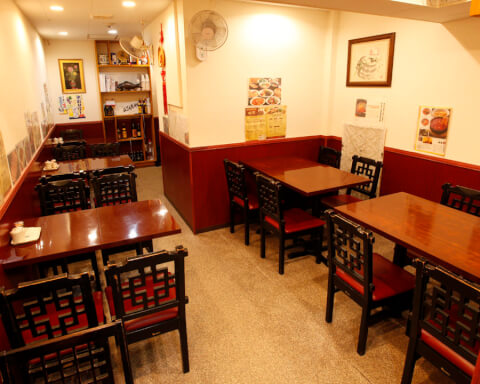
Locate an element on the screen. The width and height of the screenshot is (480, 384). picture on wall is located at coordinates (360, 68).